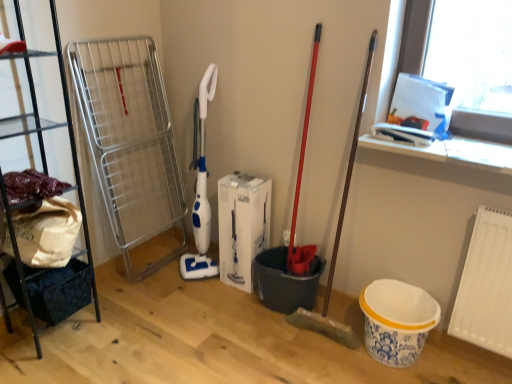
The height and width of the screenshot is (384, 512). In order to click on free space in front of black metal shelf at left in this screenshot , I will do tap(41, 366).